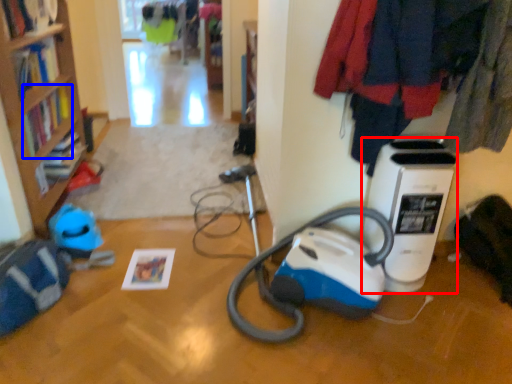
Question: Among these objects, which one is nearest to the camera, home appliance (highlighted by a red box) or book (highlighted by a blue box)?

Choices:
 (A) home appliance
 (B) book

Answer: (A)